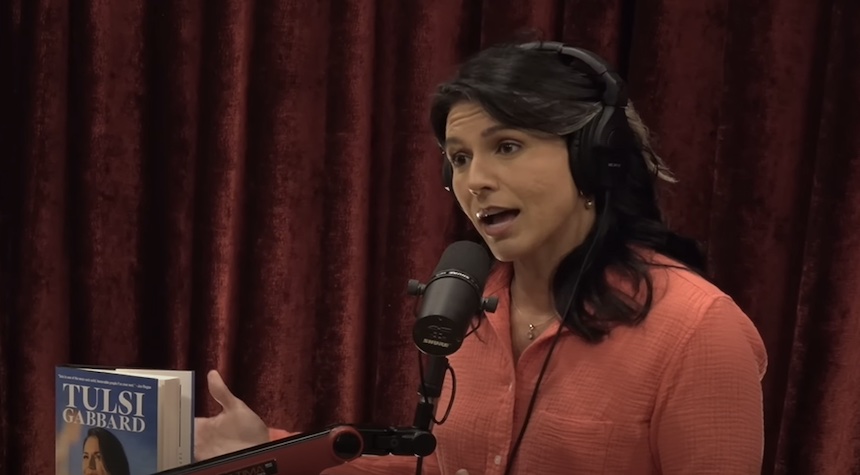
Where is `book`? This screenshot has height=475, width=860. book is located at coordinates (144, 455).